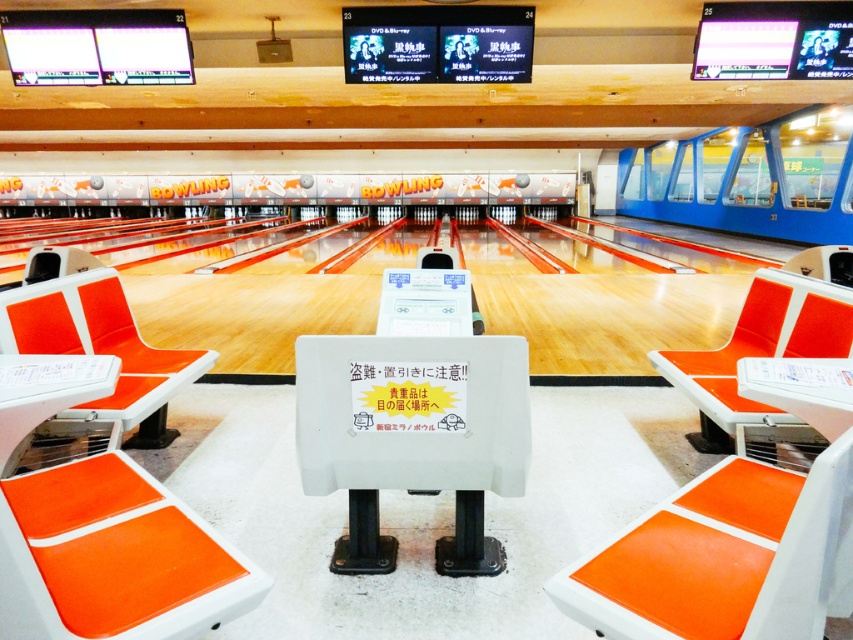
You are a guest at the bowling alley and need to sit between the orange matte seat at center and the orange plastic chair at center. Which seat has more space for your legs?

The orange matte seat at center is wider than the orange plastic chair at center, so it provides more space for your legs.

You are sitting on the orange plastic chair at left and want to move to the orange matte seat at center. Which direction should you move to reach it?

The orange matte seat at center is in front of the orange plastic chair at left, so you should move forward to reach it.

You are a maintenance worker in a bowling alley and need to move a 10 feet long equipment cart from the orange plastic chair at left to the orange plastic chair at center. Is there enough space to move the cart between these two chairs?

The orange plastic chair at left is 9.88 feet from orange plastic chair at center. Since the equipment cart is 10 feet long, there is not enough space to move it between the two chairs.